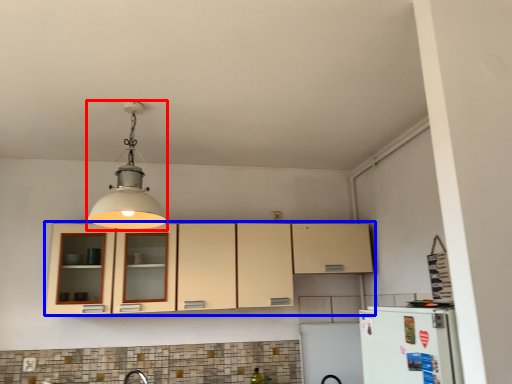
Question: Which object appears closest to the camera in this image, light fixture (highlighted by a red box) or cabinetry (highlighted by a blue box)?

Choices:
 (A) light fixture
 (B) cabinetry

Answer: (A)